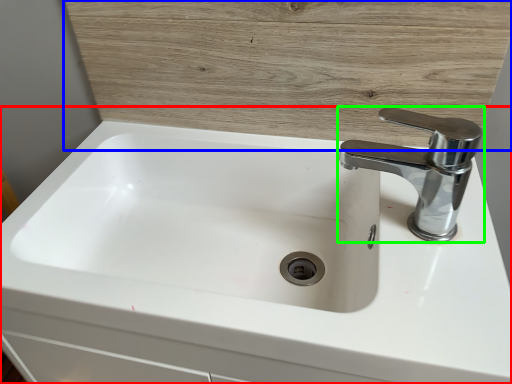
Question: Considering the real-world distances, which object is farthest from sink (highlighted by a red box)? wood (highlighted by a blue box) or tap (highlighted by a green box)?

Choices:
 (A) wood
 (B) tap

Answer: (B)